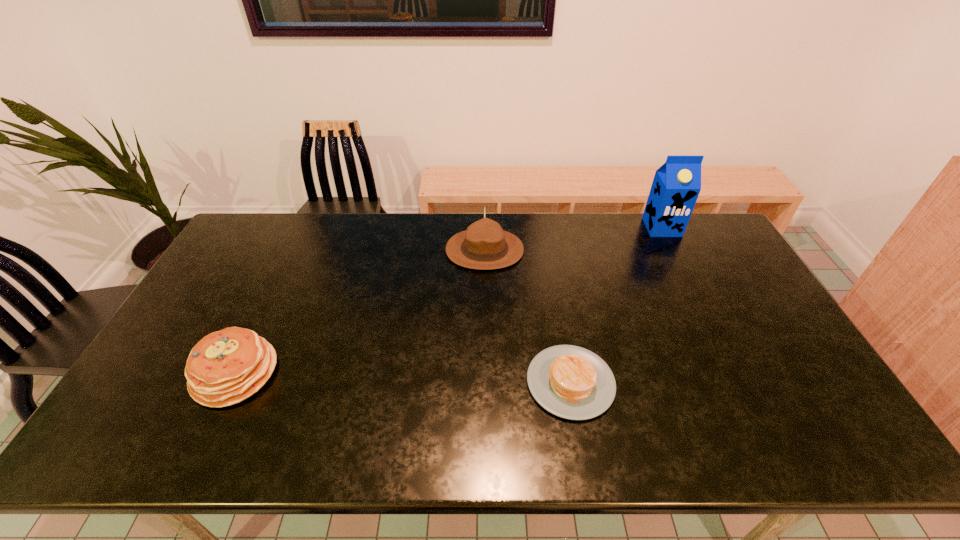
Find the location of `free location located 0.360m on the feather side of the fedora`. free location located 0.360m on the feather side of the fedora is located at coordinates (343, 250).

Identify the location of vacant position located 0.200m on the back of the taller pancake. Image resolution: width=960 pixels, height=540 pixels. pyautogui.click(x=275, y=291).

The height and width of the screenshot is (540, 960). I want to click on free space located on the left of the right pancake, so click(453, 382).

Locate an element on the screen. carton situated at the far edge is located at coordinates (676, 185).

Find the location of `fedora that is at the far edge`. fedora that is at the far edge is located at coordinates (484, 245).

Locate an element on the screen. object at the near edge is located at coordinates (571, 382).

The image size is (960, 540). Identify the location of object positioned at the left edge. (225, 367).

In order to click on object at the right edge in this screenshot , I will do `click(676, 185)`.

Image resolution: width=960 pixels, height=540 pixels. I want to click on object that is positioned at the far right corner, so click(x=676, y=185).

Image resolution: width=960 pixels, height=540 pixels. In order to click on vacant space at the far edge in this screenshot , I will do `click(511, 222)`.